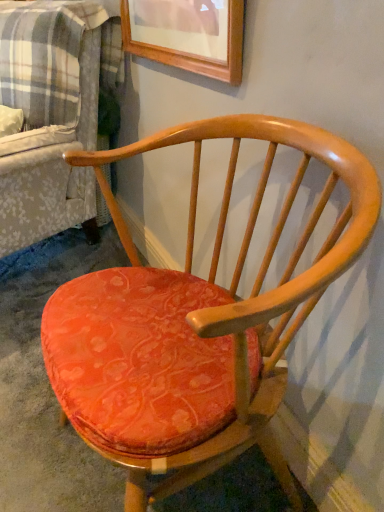
Question: Can you confirm if plaid fabric couch at left is taller than velvet orange cushion at center?

Choices:
 (A) yes
 (B) no

Answer: (A)

Question: Is plaid fabric couch at left positioned before velvet orange cushion at center?

Choices:
 (A) no
 (B) yes

Answer: (A)

Question: Considering the relative positions of plaid fabric couch at left and velvet orange cushion at center in the image provided, is plaid fabric couch at left to the right of velvet orange cushion at center from the viewer's perspective?

Choices:
 (A) no
 (B) yes

Answer: (A)

Question: Are plaid fabric couch at left and velvet orange cushion at center beside each other?

Choices:
 (A) yes
 (B) no

Answer: (B)

Question: Is plaid fabric couch at left positioned beyond the bounds of velvet orange cushion at center?

Choices:
 (A) yes
 (B) no

Answer: (A)

Question: Is point (46, 360) positioned closer to the camera than point (89, 52)?

Choices:
 (A) farther
 (B) closer

Answer: (B)

Question: In terms of height, does matte orange cushioned chair at center look taller or shorter compared to plaid fabric couch at left?

Choices:
 (A) tall
 (B) short

Answer: (B)

Question: From the image's perspective, is matte orange cushioned chair at center positioned above or below plaid fabric couch at left?

Choices:
 (A) below
 (B) above

Answer: (A)

Question: In terms of size, does matte orange cushioned chair at center appear bigger or smaller than plaid fabric couch at left?

Choices:
 (A) big
 (B) small

Answer: (B)

Question: Is velvet orange cushion at center in front of or behind matte orange cushioned chair at center in the image?

Choices:
 (A) front
 (B) behind

Answer: (B)

Question: Based on their positions, is velvet orange cushion at center located to the left or right of matte orange cushioned chair at center?

Choices:
 (A) right
 (B) left

Answer: (B)

Question: Considering the positions of velvet orange cushion at center and matte orange cushioned chair at center in the image, is velvet orange cushion at center taller or shorter than matte orange cushioned chair at center?

Choices:
 (A) short
 (B) tall

Answer: (A)

Question: Considering the positions of velvet orange cushion at center and matte orange cushioned chair at center in the image, is velvet orange cushion at center wider or thinner than matte orange cushioned chair at center?

Choices:
 (A) thin
 (B) wide

Answer: (B)

Question: Is plaid fabric couch at left in front of or behind velvet orange cushion at center in the image?

Choices:
 (A) front
 (B) behind

Answer: (B)

Question: Would you say plaid fabric couch at left is to the left or to the right of velvet orange cushion at center in the picture?

Choices:
 (A) left
 (B) right

Answer: (A)